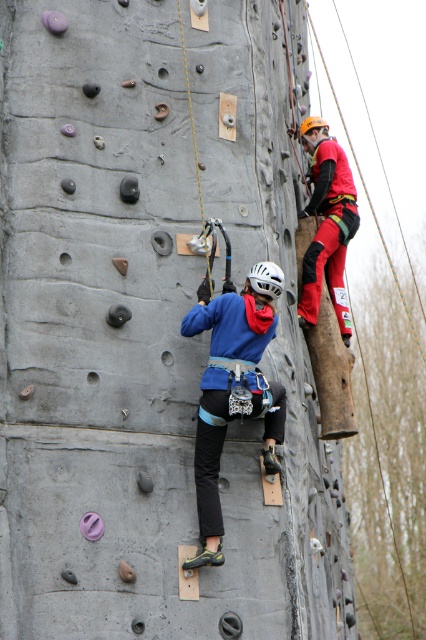
You are a climber trying to reach the top of the wall. You see two points marked on the climbing wall. Which point is closer to you, point (x=258, y=352) or point (x=337, y=312)?

Point (x=258, y=352) is closer to you than point (x=337, y=312).

You are a safety inspector checking the climbing wall setup. The safety harness must be positioned at the center of the climber for proper weight distribution. Is the blue fabric climbing harness at center correctly positioned?

The blue fabric climbing harness at center is located at point (233, 388), which is not the exact center of the climber. Therefore, it is not correctly positioned.